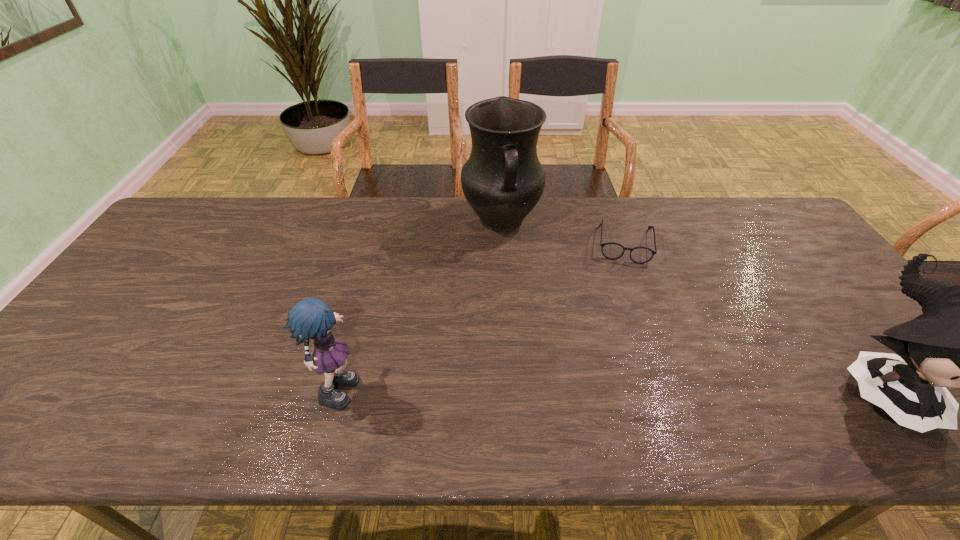
The width and height of the screenshot is (960, 540). Identify the location of rag doll. (310, 319).

Identify the location of spectacles. The height and width of the screenshot is (540, 960). (640, 255).

I want to click on the shortest object, so click(640, 255).

In order to click on pitcher in this screenshot , I will do `click(503, 179)`.

You are a GUI agent. You are given a task and a screenshot of the screen. Output one action in this format:
    pyautogui.click(x=<x>, y=<y>)
    Task: Click on the third object from right to left
    The image size is (960, 540).
    Given the screenshot: What is the action you would take?
    pyautogui.click(x=503, y=179)

I want to click on vacant space situated on the front-facing side of the rag doll, so click(x=448, y=384).

Find the location of `blank area located on the front-facing side of the third object from left to right`. blank area located on the front-facing side of the third object from left to right is located at coordinates (624, 312).

This screenshot has width=960, height=540. I want to click on vacant space located on the front-facing side of the third object from left to right, so click(624, 286).

The width and height of the screenshot is (960, 540). Find the location of `blank space located on the front-facing side of the third object from left to right`. blank space located on the front-facing side of the third object from left to right is located at coordinates (624, 293).

Image resolution: width=960 pixels, height=540 pixels. I want to click on free space located on the handle side of the pitcher, so click(x=529, y=354).